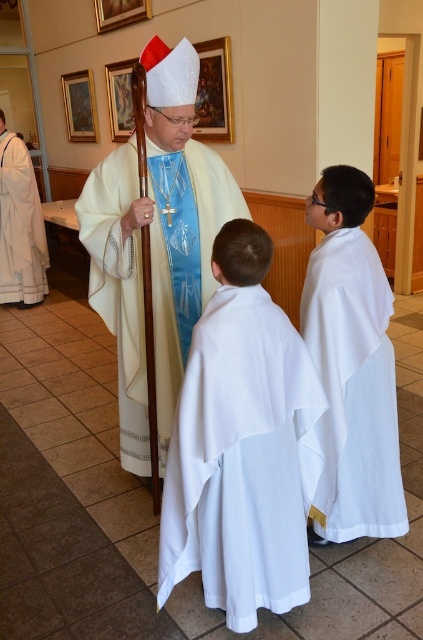
Based on the photo, between white satin robe at center and white matte robe at left, which one is positioned higher?

white matte robe at left is higher up.

Does white satin robe at center appear on the left side of white matte robe at left?

Incorrect, white satin robe at center is not on the left side of white matte robe at left.

The width and height of the screenshot is (423, 640). What do you see at coordinates (118, 289) in the screenshot?
I see `white satin robe at center` at bounding box center [118, 289].

Where is `white satin robe at center`? This screenshot has width=423, height=640. white satin robe at center is located at coordinates (118, 289).

Who is more forward, (360, 372) or (120, 156)?

Point (360, 372) is more forward.

Does white matte robe at center have a smaller size compared to white satin robe at center?

Yes.

Image resolution: width=423 pixels, height=640 pixels. Identify the location of white matte robe at center. (354, 388).

Does white matte/soft fabric robe at center appear under white matte robe at left?

Yes.

Who is higher up, white matte/soft fabric robe at center or white matte robe at left?

white matte robe at left is above.

Who is more forward, (213,541) or (41,288)?

Point (213,541) is more forward.

Locate an element on the screen. white matte/soft fabric robe at center is located at coordinates (241, 460).